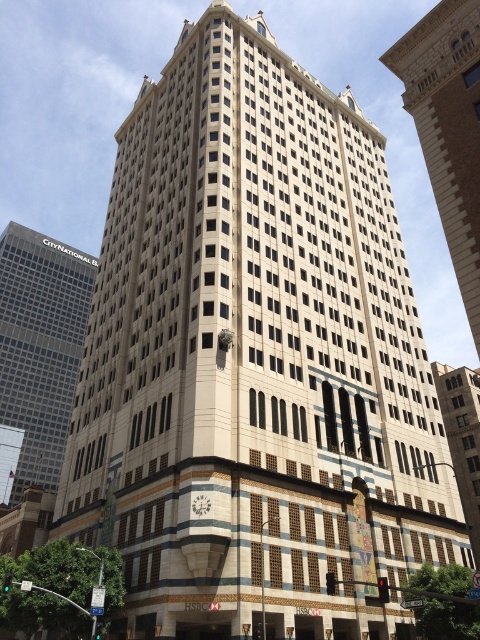
You are a drone operator tasked with flying a drone between the gray glass skyscraper at left and the beige stone building at center. The drone has a maximum flight range of 150 meters. Can the drone safely fly between them without exceeding its range?

The distance between the gray glass skyscraper at left and the beige stone building at center is 155.58 meters, which exceeds the drone operator has a maximum flight range of 150 meters. Therefore, the drone cannot safely fly between them without exceeding its range.

You are standing in front of a city skyline and see two buildings in the distance. The beige stone building at center and the slate gray stone building at center. Which one is closer to you?

The beige stone building at center is positioned over the slate gray stone building at center, meaning it is closer to you.

You are standing at point (15, 224) and want to reach the HSBC logo displayed at the curved corner base of the building. Given that the distance between you and the logo is 713.47 feet, would you need to walk more than a quarter of a mile to reach it?

The distance between you and the HSBC logo displayed at the curved corner base of the building is 713.47 feet. Since a quarter of a mile is 1,320 feet, you would not need to walk more than a quarter of a mile to reach it.